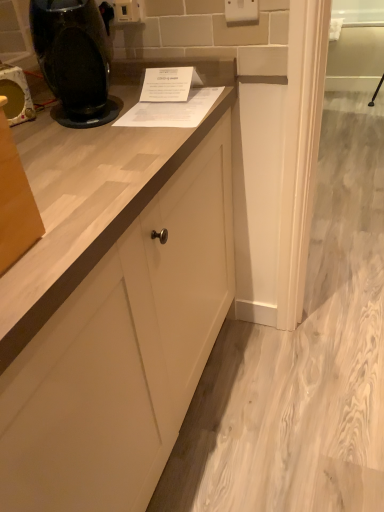
Where is `white plastic electric outlet at upper center, which is counted as the 1th electric outlet, starting from the right`? The width and height of the screenshot is (384, 512). white plastic electric outlet at upper center, which is counted as the 1th electric outlet, starting from the right is located at coordinates (241, 11).

In order to face white plastic electric outlet at upper center, positioned as the 1th electric outlet in front-to-back order, should I rotate leftwards or rightwards?

Rotate right and turn 6.846 degrees.

The image size is (384, 512). I want to click on white plastic electric outlet at upper center, acting as the 1th electric outlet starting from the back, so click(x=127, y=11).

Measure the distance between point [77,120] and camera.

Point [77,120] and camera are 3.30 feet apart from each other.

Locate an element on the screen. This screenshot has height=512, width=384. white plastic electric outlet at upper center, positioned as the 1th electric outlet in front-to-back order is located at coordinates (241, 11).

Relative to black glossy coffee machine at upper left, is white plastic electric outlet at upper center, the second electric outlet from the left, in front or behind?

In the image, white plastic electric outlet at upper center, the second electric outlet from the left, appears behind black glossy coffee machine at upper left.

Which is more to the right, white plastic electric outlet at upper center, the second electric outlet from the left, or black glossy coffee machine at upper left?

white plastic electric outlet at upper center, the second electric outlet from the left, is more to the right.

Is white plastic electric outlet at upper center, the second electric outlet from the left, wider or thinner than black glossy coffee machine at upper left?

Clearly, white plastic electric outlet at upper center, the second electric outlet from the left, has less width compared to black glossy coffee machine at upper left.

Can you confirm if white plastic electric outlet at upper center, the second electric outlet from the left, is smaller than black glossy coffee machine at upper left?

Yes, white plastic electric outlet at upper center, the second electric outlet from the left, is smaller than black glossy coffee machine at upper left.

Between white plastic electric outlet at upper center, acting as the 1th electric outlet starting from the back, and matte black coffee machine at left, which one appears on the right side from the viewer's perspective?

white plastic electric outlet at upper center, acting as the 1th electric outlet starting from the back, is more to the right.

Based on the photo, does white plastic electric outlet at upper center, the 2th electric outlet in the front-to-back sequence, turn towards matte black coffee machine at left?

No, white plastic electric outlet at upper center, the 2th electric outlet in the front-to-back sequence, is not turned towards matte black coffee machine at left.

Based on the photo, from a real-world perspective, is white plastic electric outlet at upper center, which is the first electric outlet in left-to-right order, below matte black coffee machine at left?

No, from a real-world perspective, white plastic electric outlet at upper center, which is the first electric outlet in left-to-right order, is not under matte black coffee machine at left.

Looking at the image, does white plastic electric outlet at upper center, the 2th electric outlet in the front-to-back sequence, seem bigger or smaller compared to matte black coffee machine at left?

Considering their sizes, white plastic electric outlet at upper center, the 2th electric outlet in the front-to-back sequence, takes up less space than matte black coffee machine at left.

From the image's perspective, which is above, white plastic electric outlet at upper center, which is the 2th electric outlet in right-to-left order, or white plastic electric outlet at upper center, which is counted as the 1th electric outlet, starting from the right?

From the image's view, white plastic electric outlet at upper center, which is the 2th electric outlet in right-to-left order, is above.

The width and height of the screenshot is (384, 512). I want to click on electric outlet lying in front of the white plastic electric outlet at upper center, acting as the 1th electric outlet starting from the back, so click(241, 11).

From a real-world perspective, which object stands above the other?

white plastic electric outlet at upper center, acting as the 1th electric outlet starting from the back, from a real-world perspective.

What's the angular difference between white plastic electric outlet at upper center, which is the first electric outlet in left-to-right order, and white plastic electric outlet at upper center, which appears as the second electric outlet when viewed from the back,'s facing directions?

white plastic electric outlet at upper center, which is the first electric outlet in left-to-right order, and white plastic electric outlet at upper center, which appears as the second electric outlet when viewed from the back, are facing 4.41 degrees away from each other.

Where is `home appliance below the white plastic electric outlet at upper center, acting as the 1th electric outlet starting from the back (from a real-world perspective)`? The height and width of the screenshot is (512, 384). home appliance below the white plastic electric outlet at upper center, acting as the 1th electric outlet starting from the back (from a real-world perspective) is located at coordinates (74, 59).

Which object is further away from the camera taking this photo, white plastic electric outlet at upper center, which is the first electric outlet in left-to-right order, or black glossy coffee machine at upper left?

white plastic electric outlet at upper center, which is the first electric outlet in left-to-right order, is further away from the camera.

From a real-world perspective, which object rests below the other?

black glossy coffee machine at upper left.

Could black glossy coffee machine at upper left be considered to be inside white plastic electric outlet at upper center, which is the 2th electric outlet in right-to-left order?

No, black glossy coffee machine at upper left is not a part of white plastic electric outlet at upper center, which is the 2th electric outlet in right-to-left order.

Is white plastic electric outlet at upper center, which is counted as the 1th electric outlet, starting from the right, taller or shorter than white plastic electric outlet at upper center, acting as the 1th electric outlet starting from the back?

white plastic electric outlet at upper center, which is counted as the 1th electric outlet, starting from the right, is taller than white plastic electric outlet at upper center, acting as the 1th electric outlet starting from the back.

Relative to white plastic electric outlet at upper center, the 2th electric outlet in the front-to-back sequence, is white plastic electric outlet at upper center, which is counted as the 1th electric outlet, starting from the right, in front or behind?

Clearly, white plastic electric outlet at upper center, which is counted as the 1th electric outlet, starting from the right, is in front of white plastic electric outlet at upper center, the 2th electric outlet in the front-to-back sequence.

Is white plastic electric outlet at upper center, acting as the 1th electric outlet starting from the back, at the back of white plastic electric outlet at upper center, positioned as the 1th electric outlet in front-to-back order?

No, white plastic electric outlet at upper center, positioned as the 1th electric outlet in front-to-back order, is not facing away from white plastic electric outlet at upper center, acting as the 1th electric outlet starting from the back.

Which object is wider, white plastic electric outlet at upper center, which is counted as the 1th electric outlet, starting from the right, or white plastic electric outlet at upper center, acting as the 1th electric outlet starting from the back?

Wider between the two is white plastic electric outlet at upper center, acting as the 1th electric outlet starting from the back.

Does point (101, 69) lie behind point (20, 116)?

No, it is not.

Which object is wider, black glossy coffee machine at upper left or matte black coffee machine at left?

Wider between the two is black glossy coffee machine at upper left.

Relative to matte black coffee machine at left, is black glossy coffee machine at upper left in front or behind?

In the image, black glossy coffee machine at upper left appears in front of matte black coffee machine at left.

From a real-world perspective, which is physically below, black glossy coffee machine at upper left or matte black coffee machine at left?

In real-world perspective, matte black coffee machine at left is lower.

Is matte black coffee machine at left oriented towards white plastic electric outlet at upper center, which is counted as the 1th electric outlet, starting from the right?

No, matte black coffee machine at left is not facing towards white plastic electric outlet at upper center, which is counted as the 1th electric outlet, starting from the right.

Is matte black coffee machine at left inside the boundaries of white plastic electric outlet at upper center, which is counted as the 1th electric outlet, starting from the right, or outside?

matte black coffee machine at left cannot be found inside white plastic electric outlet at upper center, which is counted as the 1th electric outlet, starting from the right.

Looking at this image, considering the relative sizes of matte black coffee machine at left and white plastic electric outlet at upper center, the second electric outlet from the left, in the image provided, is matte black coffee machine at left bigger than white plastic electric outlet at upper center, the second electric outlet from the left,?

Indeed, matte black coffee machine at left has a larger size compared to white plastic electric outlet at upper center, the second electric outlet from the left.

Is matte black coffee machine at left not near white plastic electric outlet at upper center, which is counted as the 1th electric outlet, starting from the right?

No, matte black coffee machine at left is in close proximity to white plastic electric outlet at upper center, which is counted as the 1th electric outlet, starting from the right.

Identify the location of home appliance located on the left of white plastic electric outlet at upper center, positioned as the 1th electric outlet in front-to-back order. The width and height of the screenshot is (384, 512). (74, 59).

From the image's perspective, which electric outlet is the 2nd one above the matte black coffee machine at left? Please provide its 2D coordinates.

[(127, 11)]

Considering their positions, is matte black coffee machine at left positioned closer to white plastic electric outlet at upper center, positioned as the 1th electric outlet in front-to-back order, than black glossy coffee machine at upper left?

black glossy coffee machine at upper left lies closer to white plastic electric outlet at upper center, positioned as the 1th electric outlet in front-to-back order, than the other object.

When comparing their distances from black glossy coffee machine at upper left, does white plastic electric outlet at upper center, the 2th electric outlet in the front-to-back sequence, or white plastic electric outlet at upper center, which appears as the second electric outlet when viewed from the back, seem further?

Among the two, white plastic electric outlet at upper center, which appears as the second electric outlet when viewed from the back, is located further to black glossy coffee machine at upper left.

Based on their spatial positions, is black glossy coffee machine at upper left or matte black coffee machine at left closer to white plastic electric outlet at upper center, the 2th electric outlet in the front-to-back sequence?

black glossy coffee machine at upper left.

Looking at the image, which one is located closer to white plastic electric outlet at upper center, the second electric outlet from the left, white plastic electric outlet at upper center, which is the 2th electric outlet in right-to-left order, or black glossy coffee machine at upper left?

white plastic electric outlet at upper center, which is the 2th electric outlet in right-to-left order, lies closer to white plastic electric outlet at upper center, the second electric outlet from the left, than the other object.

Considering their positions, is black glossy coffee machine at upper left positioned closer to white plastic electric outlet at upper center, the 2th electric outlet in the front-to-back sequence, than white plastic electric outlet at upper center, which is counted as the 1th electric outlet, starting from the right?

The object closer to white plastic electric outlet at upper center, the 2th electric outlet in the front-to-back sequence, is black glossy coffee machine at upper left.

When comparing their distances from matte black coffee machine at left, does white plastic electric outlet at upper center, the 2th electric outlet in the front-to-back sequence, or white plastic electric outlet at upper center, positioned as the 1th electric outlet in front-to-back order, seem further?

Among the two, white plastic electric outlet at upper center, positioned as the 1th electric outlet in front-to-back order, is located further to matte black coffee machine at left.

When comparing their distances from white plastic electric outlet at upper center, the second electric outlet from the left, does white plastic electric outlet at upper center, which is the 2th electric outlet in right-to-left order, or matte black coffee machine at left seem closer?

Among the two, white plastic electric outlet at upper center, which is the 2th electric outlet in right-to-left order, is located nearer to white plastic electric outlet at upper center, the second electric outlet from the left.

Based on their spatial positions, is black glossy coffee machine at upper left or white plastic electric outlet at upper center, acting as the 1th electric outlet starting from the back, further from matte black coffee machine at left?

white plastic electric outlet at upper center, acting as the 1th electric outlet starting from the back, is positioned further to the anchor matte black coffee machine at left.

Find the location of `electric outlet between black glossy coffee machine at upper left and white plastic electric outlet at upper center, positioned as the 1th electric outlet in front-to-back order`. electric outlet between black glossy coffee machine at upper left and white plastic electric outlet at upper center, positioned as the 1th electric outlet in front-to-back order is located at coordinates (127, 11).

Where is `electric outlet between matte black coffee machine at left and white plastic electric outlet at upper center, the second electric outlet from the left`? This screenshot has height=512, width=384. electric outlet between matte black coffee machine at left and white plastic electric outlet at upper center, the second electric outlet from the left is located at coordinates (127, 11).

I want to click on home appliance between matte black coffee machine at left and white plastic electric outlet at upper center, which appears as the second electric outlet when viewed from the back, in the horizontal direction, so click(74, 59).

Where is `home appliance between matte black coffee machine at left and white plastic electric outlet at upper center, the 2th electric outlet in the front-to-back sequence`? home appliance between matte black coffee machine at left and white plastic electric outlet at upper center, the 2th electric outlet in the front-to-back sequence is located at coordinates (x=74, y=59).